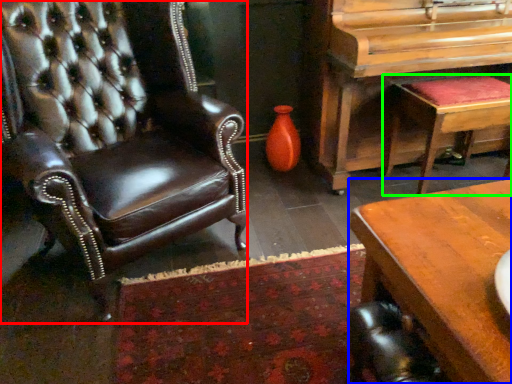
Question: Considering the real-world distances, which object is closest to chair (highlighted by a red box)? desk (highlighted by a blue box) or stool (highlighted by a green box).

Choices:
 (A) desk
 (B) stool

Answer: (A)